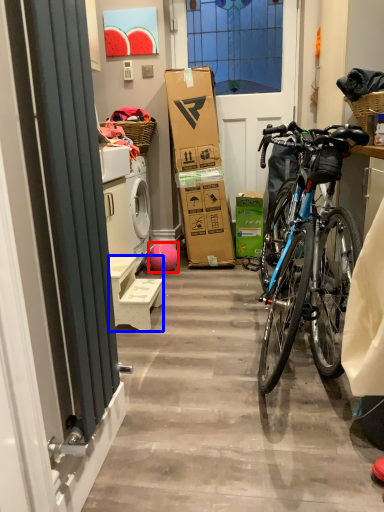
Question: Which object is closer to the camera taking this photo, ball (highlighted by a red box) or furniture (highlighted by a blue box)?

Choices:
 (A) ball
 (B) furniture

Answer: (B)